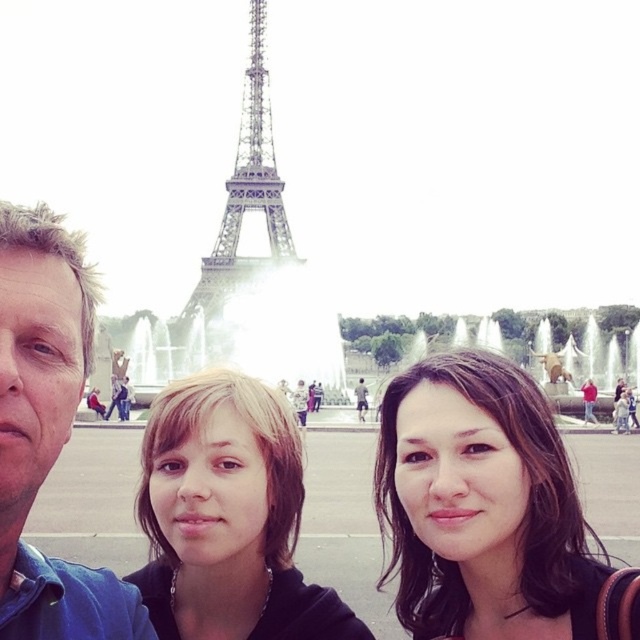
Between blue fabric shirt at left and metallic silver eiffel tower at center, which one has more height?

With more height is blue fabric shirt at left.

Is blue fabric shirt at left thinner than metallic silver eiffel tower at center?

→ Incorrect, blue fabric shirt at left's width is not less than metallic silver eiffel tower at center's.

Is point (72, 259) closer to viewer compared to point (241, 109)?

Yes, point (72, 259) is in front of point (241, 109).

Where is `blue fabric shirt at left`? This screenshot has height=640, width=640. blue fabric shirt at left is located at coordinates (45, 432).

Does point (563, 481) lie behind point (16, 515)?

Yes, point (563, 481) is behind point (16, 515).

Who is more distant from viewer, (461, 396) or (96, 593)?

The point (461, 396) is more distant.

Does point (461, 612) come farther from viewer compared to point (10, 358)?

That is True.

At what (x,y) coordinates should I click in order to perform the action: click on dark brown hair at center. Please return your answer as a coordinate pair (x, y). Image resolution: width=640 pixels, height=640 pixels. Looking at the image, I should click on (488, 512).

Is dark brown hair at center thinner than metallic silver eiffel tower at center?

In fact, dark brown hair at center might be wider than metallic silver eiffel tower at center.

Is dark brown hair at center closer to the viewer compared to metallic silver eiffel tower at center?

No, dark brown hair at center is further to the viewer.

Does point (401, 385) come in front of point (278, 212)?

No, it is behind (278, 212).

Find the location of a particular element. This screenshot has height=640, width=640. dark brown hair at center is located at coordinates (488, 512).